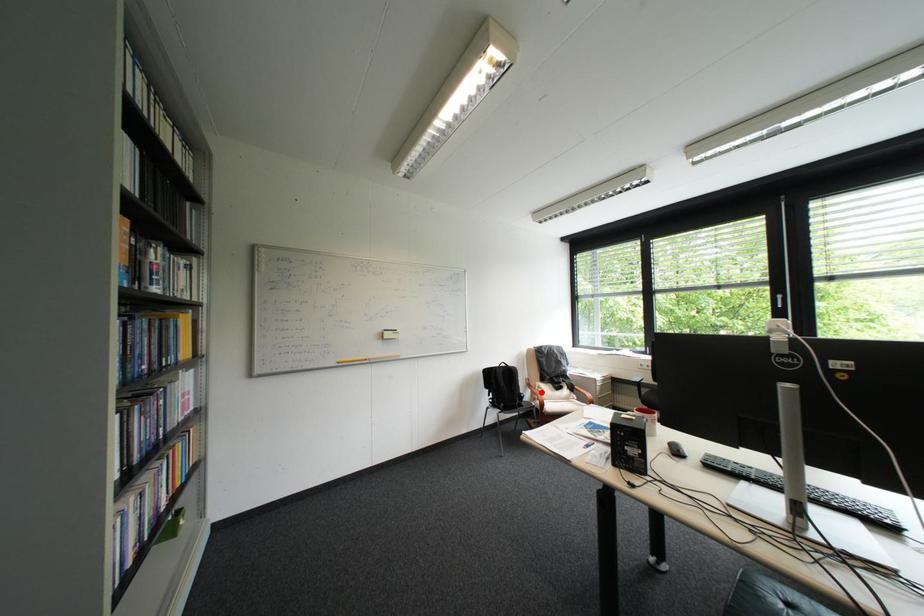
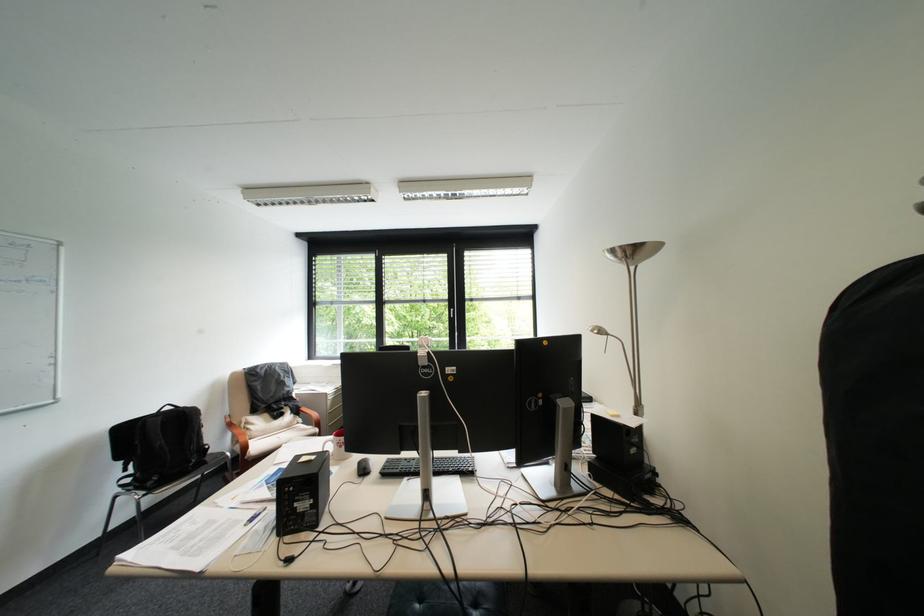
Where in the second image is the point corresponding to the highlighted location from the first image?

(241, 434)